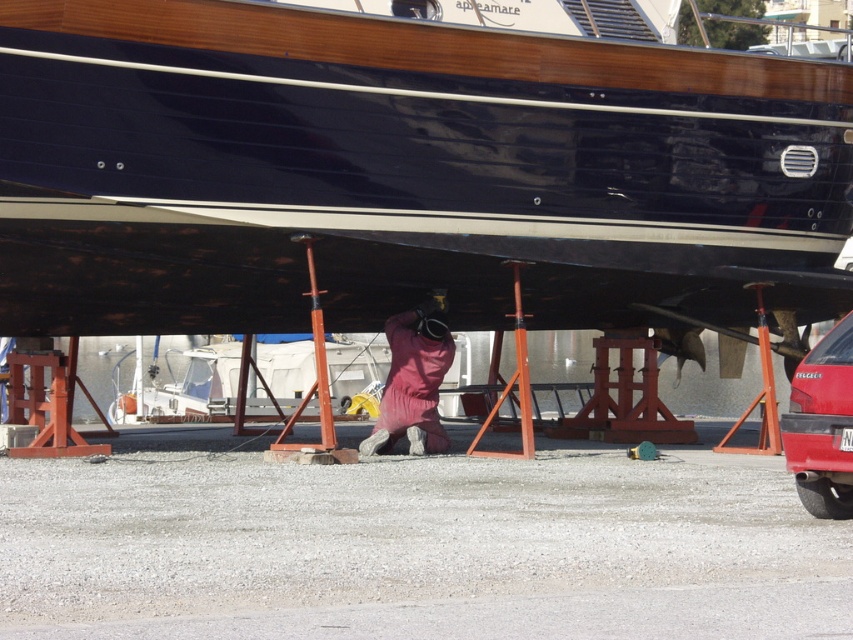
Question: Does shiny red car at lower right come behind pink fabric at center?

Choices:
 (A) yes
 (B) no

Answer: (B)

Question: Which object appears farthest from the camera in this image?

Choices:
 (A) pink fabric at center
 (B) shiny red car at lower right

Answer: (A)

Question: Is shiny red car at lower right smaller than pink fabric at center?

Choices:
 (A) yes
 (B) no

Answer: (A)

Question: Which object appears farthest from the camera in this image?

Choices:
 (A) shiny red car at lower right
 (B) pink fabric at center

Answer: (B)

Question: Is shiny red car at lower right above pink fabric at center?

Choices:
 (A) yes
 (B) no

Answer: (B)